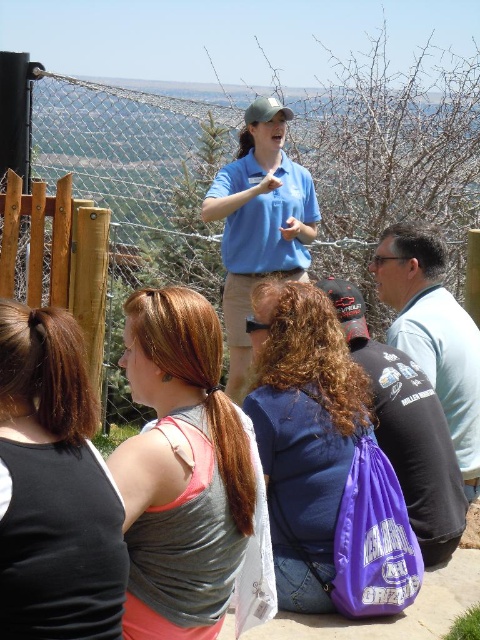
Is purple fabric bag at center bigger than light blue shirt at center?

No.

Is purple fabric bag at center to the right of light blue shirt at center from the viewer's perspective?

Incorrect, purple fabric bag at center is not on the right side of light blue shirt at center.

The width and height of the screenshot is (480, 640). Describe the element at coordinates (407, 429) in the screenshot. I see `purple fabric bag at center` at that location.

Where is `purple fabric bag at center`? Image resolution: width=480 pixels, height=640 pixels. purple fabric bag at center is located at coordinates (407, 429).

Who is taller, purple fabric backpack at center or blue cotton shirt at center?

blue cotton shirt at center

Which is above, purple fabric backpack at center or blue cotton shirt at center?

blue cotton shirt at center is higher up.

The width and height of the screenshot is (480, 640). What do you see at coordinates (303, 432) in the screenshot? I see `purple fabric backpack at center` at bounding box center [303, 432].

Where is `purple fabric backpack at center`? This screenshot has width=480, height=640. purple fabric backpack at center is located at coordinates (303, 432).

Does point (194, 472) come closer to viewer compared to point (44, 470)?

No, (194, 472) is behind (44, 470).

Does matte gray tank top at center have a smaller size compared to black fabric tank top at lower left?

Incorrect, matte gray tank top at center is not smaller in size than black fabric tank top at lower left.

Is point (186, 472) in front of point (79, 333)?

No, it is not.

Find the location of a particular element. Image resolution: width=480 pixels, height=640 pixels. matte gray tank top at center is located at coordinates (181, 470).